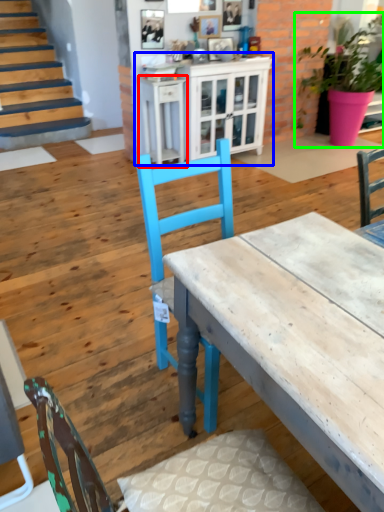
Question: Which is farther away from table (highlighted by a red box)? cabinetry (highlighted by a blue box) or houseplant (highlighted by a green box)?

Choices:
 (A) cabinetry
 (B) houseplant

Answer: (B)